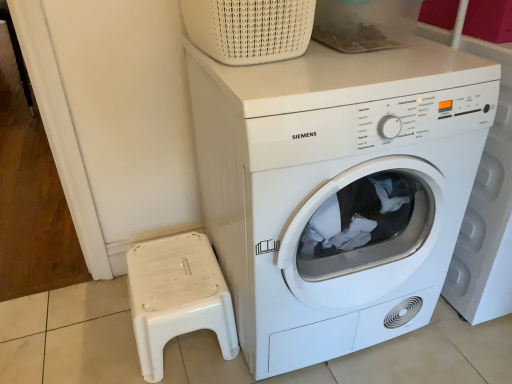
The width and height of the screenshot is (512, 384). What are the coordinates of `free space in front of white woven basket at upper center` in the screenshot? It's located at (292, 83).